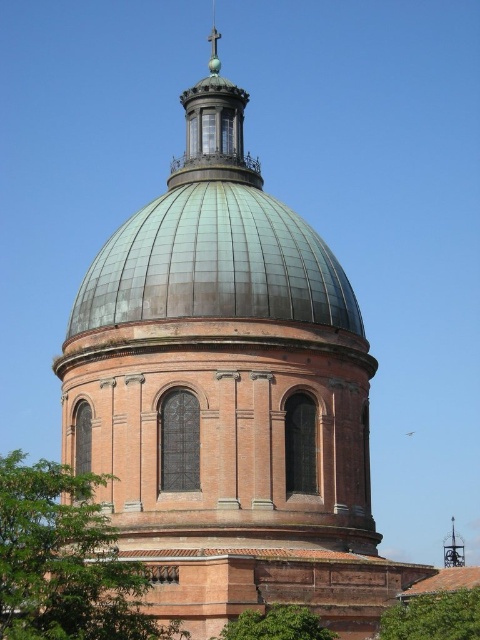
Question: Does green leafy tree at lower right lie behind green leafy tree at lower center?

Choices:
 (A) no
 (B) yes

Answer: (B)

Question: Which object is positioned farthest from the green leafy tree at lower center?

Choices:
 (A) green leafy tree at lower right
 (B) green leafy tree at lower left

Answer: (B)

Question: Where is green leafy tree at lower right located in relation to green leafy tree at lower center in the image?

Choices:
 (A) left
 (B) right

Answer: (B)

Question: Observing the image, what is the correct spatial positioning of green leafy tree at lower right in reference to green leafy tree at lower center?

Choices:
 (A) below
 (B) above

Answer: (B)

Question: Estimate the real-world distances between objects in this image. Which object is farther from the green leafy tree at lower left?

Choices:
 (A) green leafy tree at lower right
 (B) green leafy tree at lower center

Answer: (A)

Question: Which of the following is the closest to the observer?

Choices:
 (A) green leafy tree at lower center
 (B) green leafy tree at lower left
 (C) green leafy tree at lower right

Answer: (B)